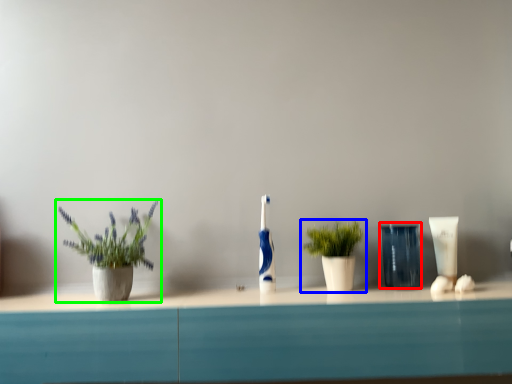
Question: Which object is positioned farthest from glass vase (highlighted by a red box)? Select from houseplant (highlighted by a blue box) and houseplant (highlighted by a green box).

Choices:
 (A) houseplant
 (B) houseplant

Answer: (B)